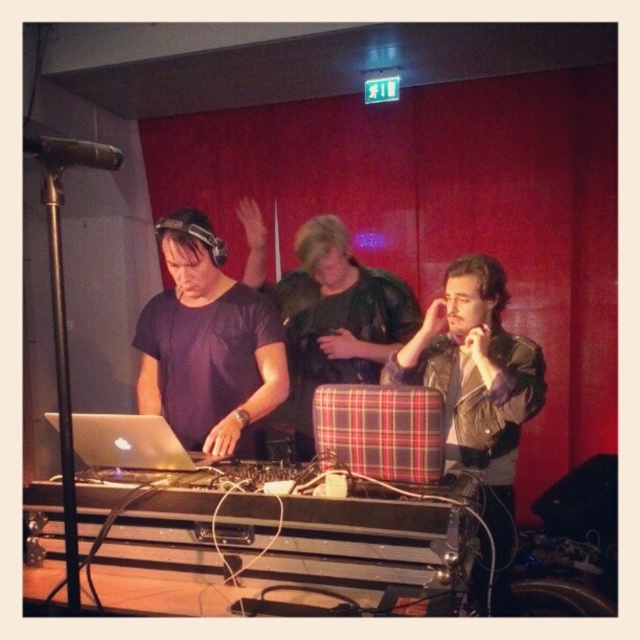
Question: Does matte black shirt at center have a greater width compared to silver metallic laptop at left?

Choices:
 (A) no
 (B) yes

Answer: (B)

Question: Can you confirm if matte black shirt at center is smaller than silver metallic laptop at left?

Choices:
 (A) yes
 (B) no

Answer: (B)

Question: Is matte black shirt at center positioned in front of leather jacket at center?

Choices:
 (A) yes
 (B) no

Answer: (B)

Question: Which of the following is the farthest from the observer?

Choices:
 (A) (128, 417)
 (B) (164, 224)
 (C) (51, 150)
 (D) (481, 552)

Answer: (B)

Question: Estimate the real-world distances between objects in this image. Which object is closer to the silver metallic laptop at left?

Choices:
 (A) matte black shirt at center
 (B) black matte microphone at upper left

Answer: (A)

Question: Among these objects, which one is nearest to the camera?

Choices:
 (A) black matte microphone at upper left
 (B) leather jacket at center

Answer: (A)